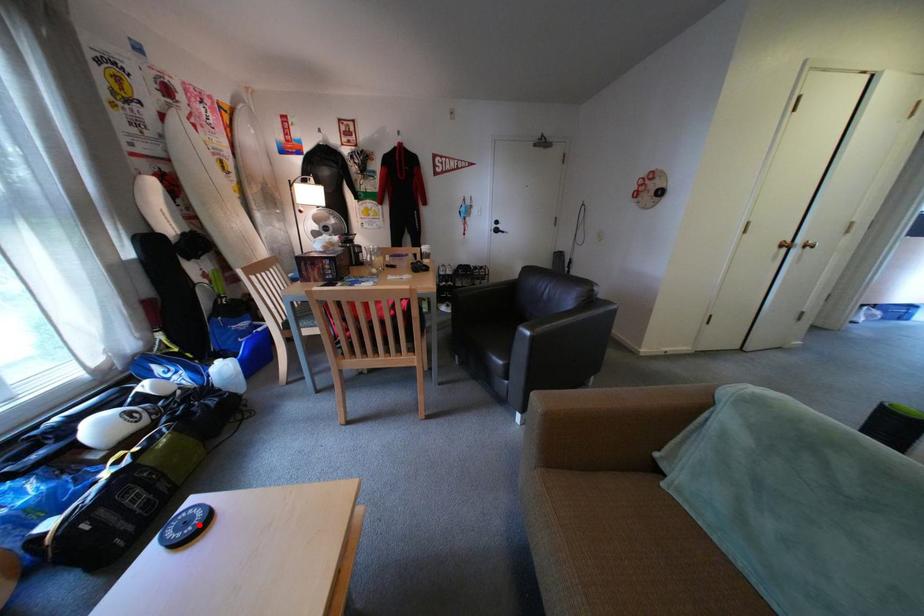
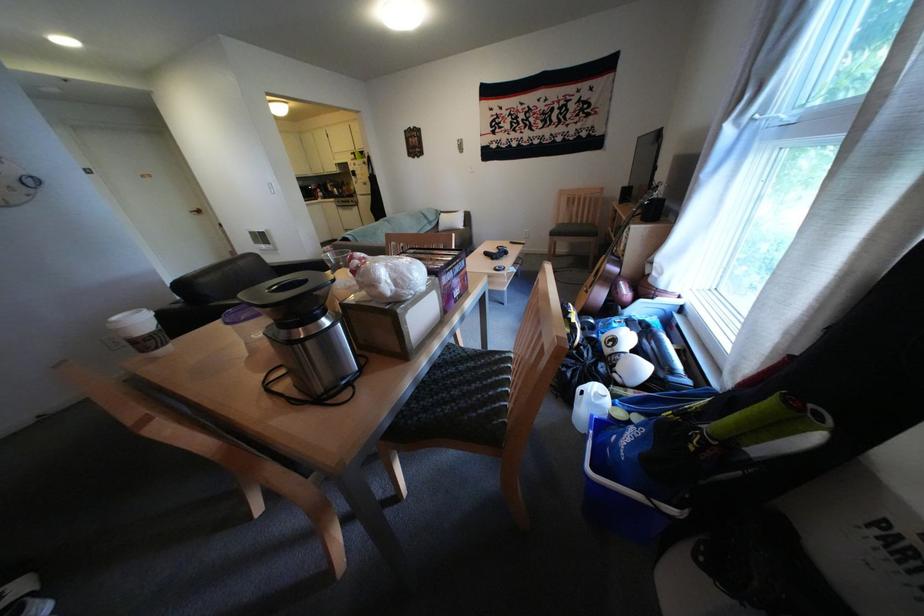
Question: I am providing you with two images of the same scene from different viewpoints. A red point is marked on the first image. Is the red point's position out of view in image 2?

Choices:
 (A) Yes
 (B) No

Answer: (A)